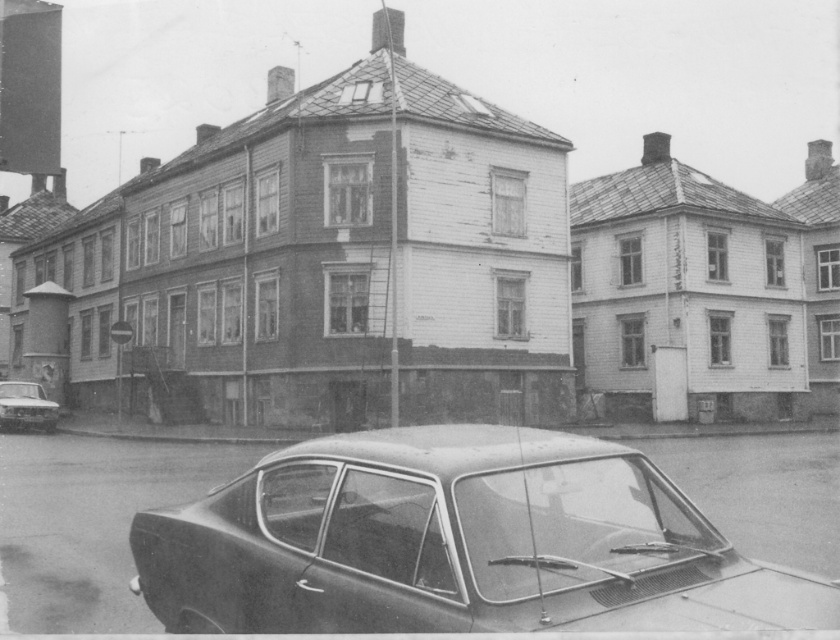
You are a delivery person trying to park your van between the dark gray metallic car at lower center and the shiny silver sedan at lower left. Based on the scene, can your van, which is 2 meters wide, fit in the space between them?

The dark gray metallic car at lower center is thinner than the shiny silver sedan at lower left, but the exact width of the space between them isn

You are a delivery person trying to park your truck, which is 2 meters tall, in this street scene. You see the dark gray metallic car at lower center and the shiny silver sedan at lower left. Which vehicle should you avoid parking next to if you need to leave enough vertical clearance for your truck?

You should avoid parking next to the dark gray metallic car at lower center because it has a greater height compared to the shiny silver sedan at lower left, which means there might be less vertical clearance available.

You are a pedestrian standing at the entrance of the street scene. You see a dark gray metallic car at lower center and a shiny silver sedan at lower left. Which vehicle is positioned higher up the street?

The dark gray metallic car at lower center is positioned higher up the street than the shiny silver sedan at lower left because it is located above it in the image.